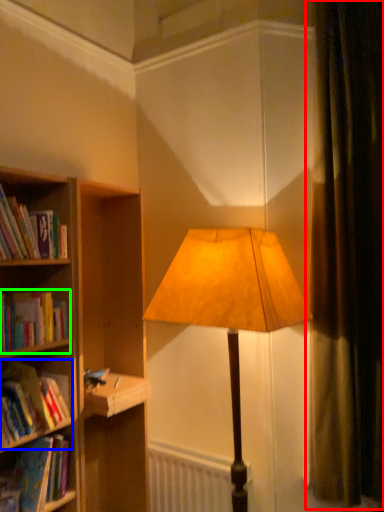
Question: Based on their relative distances, which object is farther from curtain (highlighted by a red box)? Choose from book (highlighted by a blue box) and book (highlighted by a green box).

Choices:
 (A) book
 (B) book

Answer: (A)